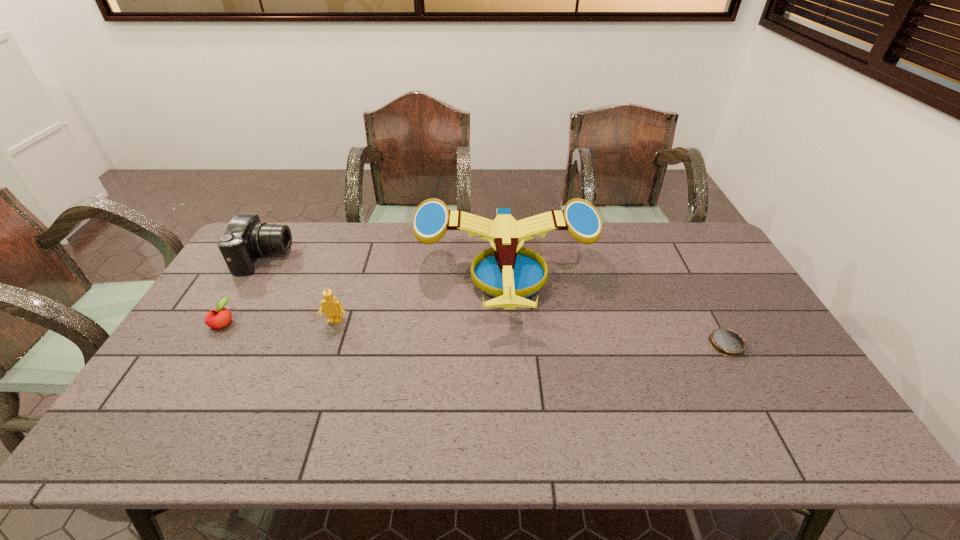
I want to click on vacant space in between the camera and the apple, so click(244, 289).

Find the location of a particular element. The image size is (960, 540). free space between the drone and the camera is located at coordinates (385, 265).

I want to click on object that ranks as the closest to the tallest object, so click(x=333, y=309).

This screenshot has width=960, height=540. Find the location of `object that is the third closest to the camera`. object that is the third closest to the camera is located at coordinates (510, 273).

The width and height of the screenshot is (960, 540). In order to click on vacant space that satisfies the following two spatial constraints: 1. on the face of the compass; 2. on the right side of the third tallest object in this screenshot , I will do 327,345.

I want to click on vacant point that satisfies the following two spatial constraints: 1. on the face of the shortest object; 2. on the left side of the Lego, so click(327, 345).

This screenshot has width=960, height=540. What are the coordinates of `blank area in the image that satisfies the following two spatial constraints: 1. on the lens of the rightmost object; 2. on the right side of the camera` in the screenshot? It's located at (214, 345).

Where is `free spot that satisfies the following two spatial constraints: 1. on the face of the third shortest object; 2. on the left side of the rightmost object`? The image size is (960, 540). free spot that satisfies the following two spatial constraints: 1. on the face of the third shortest object; 2. on the left side of the rightmost object is located at coordinates (327, 345).